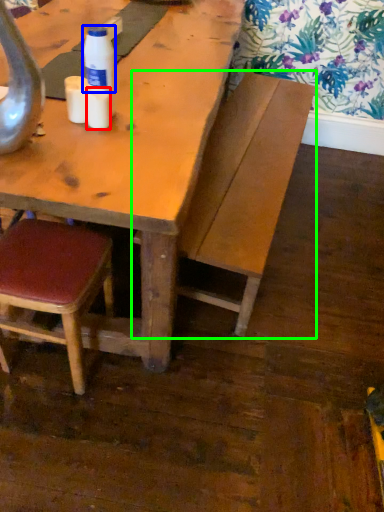
Question: Considering the real-world distances, which object is closest to coffee cup (highlighted by a red box)? bottle (highlighted by a blue box) or bench (highlighted by a green box).

Choices:
 (A) bottle
 (B) bench

Answer: (A)